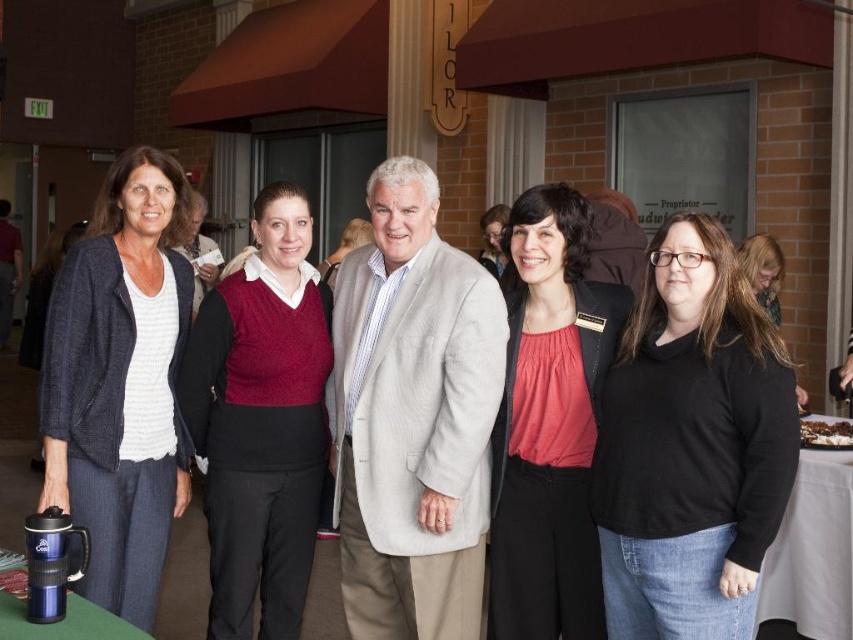
What do you see at coordinates (811, 550) in the screenshot? This screenshot has width=853, height=640. I see `white cloth table at lower right` at bounding box center [811, 550].

Can you confirm if white cloth table at lower right is positioned above blonde hair at center?

No, white cloth table at lower right is not above blonde hair at center.

Find the location of a particular element. The width and height of the screenshot is (853, 640). white cloth table at lower right is located at coordinates (811, 550).

Identify the location of white cloth table at lower right. 811,550.

Between matte black jacket at left and matte red sweater at center, which one is positioned higher?

Positioned higher is matte red sweater at center.

Who is taller, matte black jacket at left or matte red sweater at center?

matte black jacket at left

Locate an element on the screen. matte black jacket at left is located at coordinates (120, 381).

Is matte black jacket at left smaller than blonde hair at center?

Actually, matte black jacket at left might be larger than blonde hair at center.

Can you confirm if matte black jacket at left is taller than blonde hair at center?

Indeed, matte black jacket at left has a greater height compared to blonde hair at center.

Which is behind, point (169, 243) or point (769, 280)?

Point (769, 280)

Locate an element on the screen. matte black jacket at left is located at coordinates (120, 381).